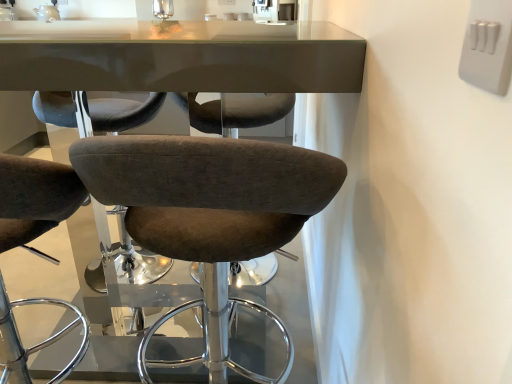
Describe the element at coordinates (274, 11) in the screenshot. I see `white glossy sink at upper center` at that location.

Identify the location of brown fabric stool at center. The image size is (512, 384). click(209, 211).

How far apart are white plastic switch at upper right and brown fabric stool at center?

white plastic switch at upper right and brown fabric stool at center are 17.04 inches apart from each other.

Considering the relative positions of white plastic switch at upper right and brown fabric stool at center in the image provided, is white plastic switch at upper right to the right of brown fabric stool at center from the viewer's perspective?

Indeed, white plastic switch at upper right is positioned on the right side of brown fabric stool at center.

What's the angular difference between white plastic switch at upper right and brown fabric stool at center's facing directions?

89.4 degrees.

From the picture: Who is bigger, white plastic switch at upper right or brown fabric stool at center?

brown fabric stool at center is bigger.

Between white glossy sink at upper center and white plastic switch at upper right, which one is positioned in front?

white plastic switch at upper right is in front.

Can you confirm if white glossy sink at upper center is shorter than white plastic switch at upper right?

No.

Between white glossy sink at upper center and white plastic switch at upper right, which one appears on the right side from the viewer's perspective?

white plastic switch at upper right is more to the right.

From the image's perspective, is white glossy sink at upper center under white plastic switch at upper right?

No, from the image's perspective, white glossy sink at upper center is not below white plastic switch at upper right.

How many degrees apart are the facing directions of brown fabric stool at center and white glossy sink at upper center?

The angle between the facing direction of brown fabric stool at center and the facing direction of white glossy sink at upper center is 146 degrees.

From the image's perspective, is brown fabric stool at center below white glossy sink at upper center?

Indeed, from the image's perspective, brown fabric stool at center is shown beneath white glossy sink at upper center.

The image size is (512, 384). What are the coordinates of `sink that is above the brown fabric stool at center (from the image's perspective)` in the screenshot? It's located at (274, 11).

From the picture: Is brown fabric stool at center in front of white glossy sink at upper center?

Yes, it is in front of white glossy sink at upper center.

Does white plastic switch at upper right have a lesser height compared to white glossy sink at upper center?

Yes, white plastic switch at upper right is shorter than white glossy sink at upper center.

Can you confirm if white plastic switch at upper right is smaller than white glossy sink at upper center?

Correct, white plastic switch at upper right occupies less space than white glossy sink at upper center.

From the image's perspective, is white plastic switch at upper right located beneath white glossy sink at upper center?

Indeed, from the image's perspective, white plastic switch at upper right is shown beneath white glossy sink at upper center.

Where is `sink lying above the white plastic switch at upper right (from the image's perspective)`? sink lying above the white plastic switch at upper right (from the image's perspective) is located at coordinates (274, 11).

Does brown fabric stool at center come in front of white plastic switch at upper right?

No, brown fabric stool at center is further to the viewer.

From the picture: From a real-world perspective, who is located lower, brown fabric stool at center or white plastic switch at upper right?

brown fabric stool at center is physically lower.

The width and height of the screenshot is (512, 384). What are the coordinates of `chair to the left of white plastic switch at upper right` in the screenshot? It's located at (209, 211).

From a real-world perspective, is white glossy sink at upper center located beneath brown fabric stool at center?

No, from a real-world perspective, white glossy sink at upper center is not below brown fabric stool at center.

How far apart are white glossy sink at upper center and brown fabric stool at center?

The distance of white glossy sink at upper center from brown fabric stool at center is 2.76 meters.

Is white glossy sink at upper center at the right side of brown fabric stool at center?

Indeed, white glossy sink at upper center is positioned on the right side of brown fabric stool at center.

Where is `sink lying on the right of brown fabric stool at center`? This screenshot has width=512, height=384. sink lying on the right of brown fabric stool at center is located at coordinates (274, 11).

Locate an element on the screen. chair on the left of white plastic switch at upper right is located at coordinates (209, 211).

Where is `electric outlet positioned vertically above the white glossy sink at upper center (from a real-world perspective)`? electric outlet positioned vertically above the white glossy sink at upper center (from a real-world perspective) is located at coordinates (488, 46).

Estimate the real-world distances between objects in this image. Which object is closer to white plastic switch at upper right, white glossy sink at upper center or brown fabric stool at center?

brown fabric stool at center is positioned closer to the anchor white plastic switch at upper right.

From the image, which object appears to be nearer to white glossy sink at upper center, white plastic switch at upper right or brown fabric stool at center?

brown fabric stool at center is positioned closer to the anchor white glossy sink at upper center.

Which object lies nearer to the anchor point brown fabric stool at center, white plastic switch at upper right or white glossy sink at upper center?

white plastic switch at upper right is positioned closer to the anchor brown fabric stool at center.

Which object lies further to the anchor point white plastic switch at upper right, brown fabric stool at center or white glossy sink at upper center?

white glossy sink at upper center.

Based on their spatial positions, is brown fabric stool at center or white plastic switch at upper right further from white glossy sink at upper center?

Among the two, white plastic switch at upper right is located further to white glossy sink at upper center.

Which object lies nearer to the anchor point brown fabric stool at center, white glossy sink at upper center or white plastic switch at upper right?

white plastic switch at upper right.

I want to click on chair located between white plastic switch at upper right and white glossy sink at upper center in the depth direction, so click(209, 211).